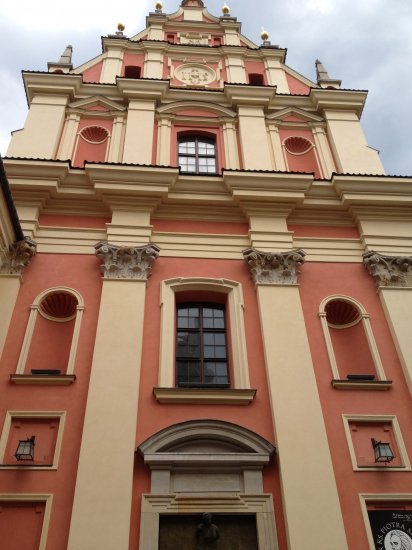
Where is `glass`? Image resolution: width=412 pixels, height=550 pixels. glass is located at coordinates (189, 316), (223, 321), (216, 344), (183, 348), (185, 371), (219, 372), (187, 145), (205, 146), (209, 166), (180, 165).